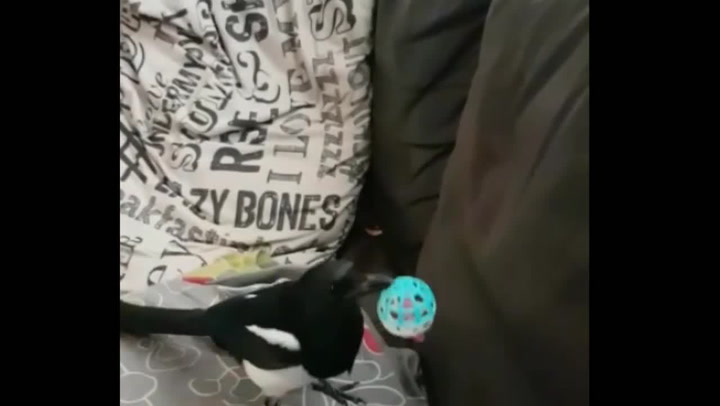
This screenshot has height=406, width=720. Find the location of `second gray cushion`. second gray cushion is located at coordinates (405, 94).